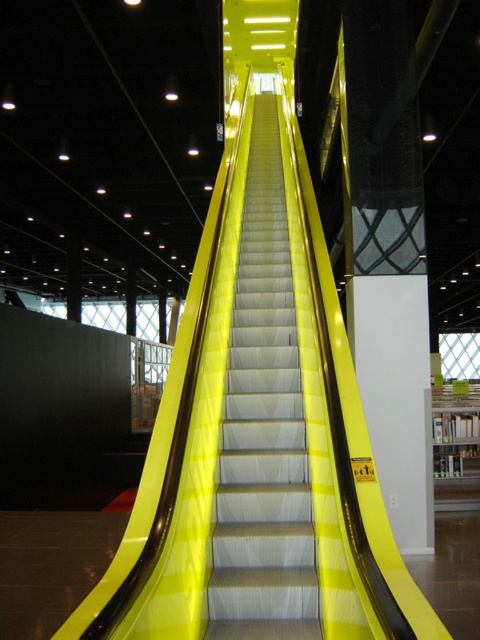
Question: Can you confirm if yellow glossy escalator at center is positioned below white glossy pillar at center?

Choices:
 (A) yes
 (B) no

Answer: (A)

Question: Can you confirm if yellow glossy escalator at center is positioned to the left of white glossy pillar at center?

Choices:
 (A) no
 (B) yes

Answer: (B)

Question: Can you confirm if yellow glossy escalator at center is positioned to the right of white glossy pillar at center?

Choices:
 (A) no
 (B) yes

Answer: (A)

Question: Which point is farther to the camera?

Choices:
 (A) (372, 340)
 (B) (253, 541)

Answer: (A)